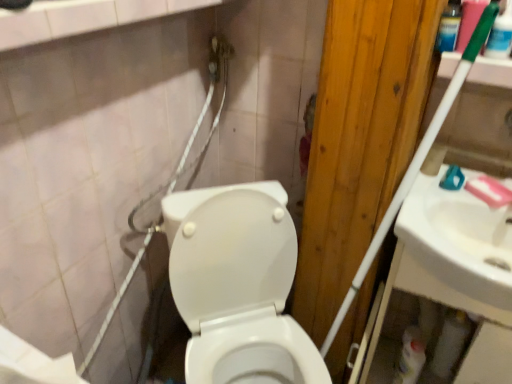
What is the approximate height of white glossy bottle at lower right?

The height of white glossy bottle at lower right is 10.96 inches.

The height and width of the screenshot is (384, 512). What do you see at coordinates (33, 363) in the screenshot?
I see `white matte toilet paper at lower left, positioned as the first toilet paper in top-to-bottom order` at bounding box center [33, 363].

Measure the distance between point (426, 212) and camera.

The depth of point (426, 212) is 3.38 feet.

The image size is (512, 384). What do you see at coordinates (450, 343) in the screenshot? I see `white matte toilet paper at lower right, the 1th toilet paper positioned from the right` at bounding box center [450, 343].

Describe the element at coordinates (238, 285) in the screenshot. The width and height of the screenshot is (512, 384). I see `white glossy toilet at center` at that location.

Where is `white glossy bottle at lower right`? white glossy bottle at lower right is located at coordinates (410, 357).

Which object is closer to the camera, white glossy sink at right or clear plastic bottle at upper right?

white glossy sink at right.

Can you confirm if white glossy sink at right is positioned to the right of clear plastic bottle at upper right?

Correct, you'll find white glossy sink at right to the right of clear plastic bottle at upper right.

From the image's perspective, is white glossy sink at right above or below clear plastic bottle at upper right?

white glossy sink at right is below clear plastic bottle at upper right.

Does white glossy sink at right have a greater width compared to clear plastic bottle at upper right?

Indeed, white glossy sink at right has a greater width compared to clear plastic bottle at upper right.

Is white matte toilet paper at lower left, the second toilet paper viewed from the right, facing towards clear plastic bottle at upper right?

No.

From a real-world perspective, relative to clear plastic bottle at upper right, is white matte toilet paper at lower left, placed as the 1th toilet paper when sorted from left to right, vertically above or below?

In terms of real-world spatial position, white matte toilet paper at lower left, placed as the 1th toilet paper when sorted from left to right, is below clear plastic bottle at upper right.

From the image's perspective, is white matte toilet paper at lower left, positioned as the first toilet paper in top-to-bottom order, beneath clear plastic bottle at upper right?

Correct, white matte toilet paper at lower left, positioned as the first toilet paper in top-to-bottom order, appears lower than clear plastic bottle at upper right in the image.

Is white matte toilet paper at lower left, the second toilet paper viewed from the right, thinner than clear plastic bottle at upper right?

No, white matte toilet paper at lower left, the second toilet paper viewed from the right, is not thinner than clear plastic bottle at upper right.

From a real-world perspective, is white matte toilet paper at lower right, the 1th toilet paper positioned from the right, physically located above or below pink matte soap at upper right?

white matte toilet paper at lower right, the 1th toilet paper positioned from the right, is situated lower than pink matte soap at upper right in the real world.

Between white matte toilet paper at lower right, which appears as the first toilet paper when ordered from the bottom, and pink matte soap at upper right, which one has more height?

white matte toilet paper at lower right, which appears as the first toilet paper when ordered from the bottom, is taller.

From the image's perspective, is white matte toilet paper at lower right, the 1th toilet paper positioned from the right, located beneath pink matte soap at upper right?

Indeed, from the image's perspective, white matte toilet paper at lower right, the 1th toilet paper positioned from the right, is shown beneath pink matte soap at upper right.

How different are the orientations of white matte toilet paper at lower right, the 1th toilet paper positioned from the right, and pink matte soap at upper right in degrees?

white matte toilet paper at lower right, the 1th toilet paper positioned from the right, and pink matte soap at upper right are facing 47.5 degrees away from each other.

How far apart are clear plastic bottle at upper right and pink matte soap at upper right?

38.11 centimeters.

From the image's perspective, is clear plastic bottle at upper right located beneath pink matte soap at upper right?

No.

Can you tell me how much clear plastic bottle at upper right and pink matte soap at upper right differ in facing direction?

46.8 degrees separate the facing orientations of clear plastic bottle at upper right and pink matte soap at upper right.

Between clear plastic bottle at upper right and pink matte soap at upper right, which one has more height?

clear plastic bottle at upper right is taller.

Looking at their sizes, would you say white glossy bottle at lower right is wider or thinner than white matte toilet paper at lower right, the second toilet paper in the front-to-back sequence?

white glossy bottle at lower right is wider than white matte toilet paper at lower right, the second toilet paper in the front-to-back sequence.

Which of these two, white glossy bottle at lower right or white matte toilet paper at lower right, which is counted as the 1th toilet paper, starting from the back, is bigger?

white glossy bottle at lower right.

Considering the relative positions of white glossy bottle at lower right and white matte toilet paper at lower right, which appears as the first toilet paper when ordered from the bottom, in the image provided, is white glossy bottle at lower right to the right of white matte toilet paper at lower right, which appears as the first toilet paper when ordered from the bottom, from the viewer's perspective?

No.

Considering the sizes of objects white glossy bottle at lower right and white matte toilet paper at lower right, the 2th toilet paper when ordered from top to bottom, in the image provided, who is shorter, white glossy bottle at lower right or white matte toilet paper at lower right, the 2th toilet paper when ordered from top to bottom,?

Standing shorter between the two is white glossy bottle at lower right.

Which object is further away from the camera, clear plastic bottle at upper right or white glossy toilet at center?

Positioned behind is clear plastic bottle at upper right.

From a real-world perspective, is clear plastic bottle at upper right beneath white glossy toilet at center?

No.

From the picture: Considering the relative sizes of clear plastic bottle at upper right and white glossy toilet at center in the image provided, is clear plastic bottle at upper right thinner than white glossy toilet at center?

Yes.

Consider the image. Is white glossy toilet at center touching clear plastic bottle at upper right?

No, white glossy toilet at center is not making contact with clear plastic bottle at upper right.

Is white glossy toilet at center at the right side of clear plastic bottle at upper right?

No, white glossy toilet at center is not to the right of clear plastic bottle at upper right.

From the image's perspective, which is below, white glossy toilet at center or clear plastic bottle at upper right?

white glossy toilet at center.

Where is `mouthwash positioned vertically above the white glossy sink at right (from a real-world perspective)`? mouthwash positioned vertically above the white glossy sink at right (from a real-world perspective) is located at coordinates (449, 27).

The image size is (512, 384). In order to click on toilet paper lying in front of the clear plastic bottle at upper right in this screenshot , I will do `click(33, 363)`.

Estimate the real-world distances between objects in this image. Which object is closer to white matte toilet paper at lower right, which appears as the 2th toilet paper when viewed from the left, white glossy bottle at lower right or white glossy sink at right?

The object closer to white matte toilet paper at lower right, which appears as the 2th toilet paper when viewed from the left, is white glossy bottle at lower right.

From the picture: Based on their spatial positions, is white glossy toilet at center or white matte toilet paper at lower left, placed as the 1th toilet paper when sorted from left to right, closer to pink matte soap at upper right?

The object closer to pink matte soap at upper right is white glossy toilet at center.

Based on their spatial positions, is white glossy bottle at lower right or pink matte soap at upper right closer to clear plastic bottle at upper right?

pink matte soap at upper right.

Looking at the image, which one is located closer to white glossy sink at right, clear plastic bottle at upper right or white matte toilet paper at lower left, placed as the 2th toilet paper when sorted from back to front?

Among the two, clear plastic bottle at upper right is located nearer to white glossy sink at right.

Based on their spatial positions, is clear plastic bottle at upper right or pink matte soap at upper right closer to white glossy bottle at lower right?

pink matte soap at upper right is positioned closer to the anchor white glossy bottle at lower right.

Looking at the image, which one is located further to white matte toilet paper at lower right, the 1th toilet paper positioned from the right, white glossy toilet at center or clear plastic bottle at upper right?

Based on the image, clear plastic bottle at upper right appears to be further to white matte toilet paper at lower right, the 1th toilet paper positioned from the right.

Based on their spatial positions, is white glossy toilet at center or pink matte soap at upper right further from white matte toilet paper at lower right, the 2th toilet paper when ordered from top to bottom?

Among the two, white glossy toilet at center is located further to white matte toilet paper at lower right, the 2th toilet paper when ordered from top to bottom.

Looking at this image, considering their positions, is white glossy bottle at lower right positioned closer to clear plastic bottle at upper right than white glossy sink at right?

white glossy sink at right is closer to clear plastic bottle at upper right.

I want to click on sink between white matte toilet paper at lower left, positioned as the first toilet paper in top-to-bottom order, and pink matte soap at upper right from left to right, so click(x=454, y=250).

Where is `soap between white matte toilet paper at lower left, the second toilet paper viewed from the right, and white matte toilet paper at lower right, which appears as the first toilet paper when ordered from the bottom, from left to right`? The image size is (512, 384). soap between white matte toilet paper at lower left, the second toilet paper viewed from the right, and white matte toilet paper at lower right, which appears as the first toilet paper when ordered from the bottom, from left to right is located at coordinates (489, 191).

Locate an element on the screen. This screenshot has height=384, width=512. soap between clear plastic bottle at upper right and white glossy bottle at lower right from top to bottom is located at coordinates (489, 191).

Locate an element on the screen. cleaning product between white glossy toilet at center and white glossy sink at right is located at coordinates (410, 357).